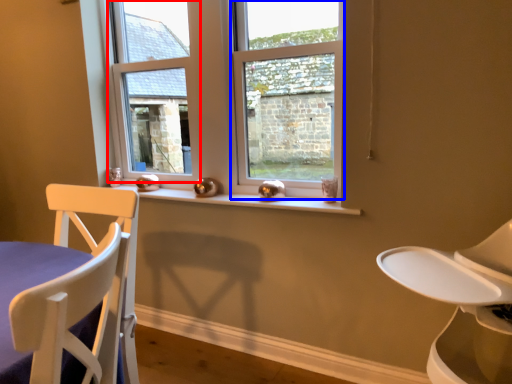
Question: Among these objects, which one is nearest to the camera, window frame (highlighted by a red box) or window (highlighted by a blue box)?

Choices:
 (A) window frame
 (B) window

Answer: (B)